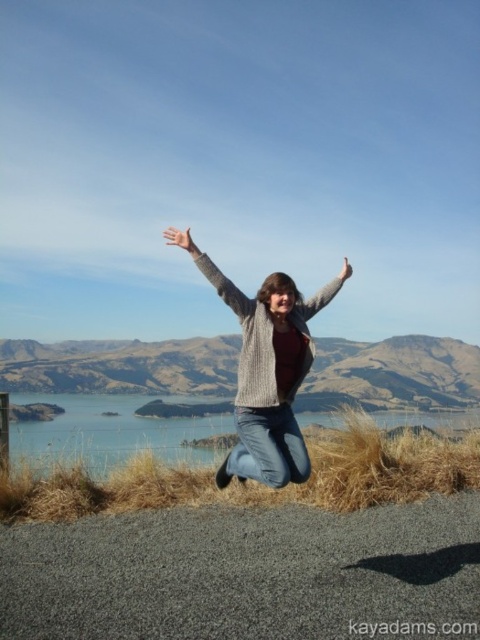
Between blue water at center and gray woolen sweater at upper center, which one has less height?

Standing shorter between the two is gray woolen sweater at upper center.

Does blue water at center appear on the right side of gray woolen sweater at upper center?

Yes, blue water at center is to the right of gray woolen sweater at upper center.

Find the location of `blue water at center`. blue water at center is located at coordinates (x=108, y=432).

Does knitted sweater at center appear under gray woolen sweater at upper center?

Yes, knitted sweater at center is below gray woolen sweater at upper center.

In the scene shown: Does knitted sweater at center appear on the right side of gray woolen sweater at upper center?

Indeed, knitted sweater at center is positioned on the right side of gray woolen sweater at upper center.

Between point (257, 472) and point (241, 307), which one is positioned behind?

The point (241, 307) is behind.

This screenshot has height=640, width=480. What are the coordinates of `knitted sweater at center` in the screenshot? It's located at (266, 369).

Between point (193, 244) and point (392, 420), which one is positioned behind?

The point (392, 420) is behind.

Who is more forward, (238,433) or (93,419)?

Point (238,433)

Where is `knitted sweater at center`? The height and width of the screenshot is (640, 480). knitted sweater at center is located at coordinates (x=266, y=369).